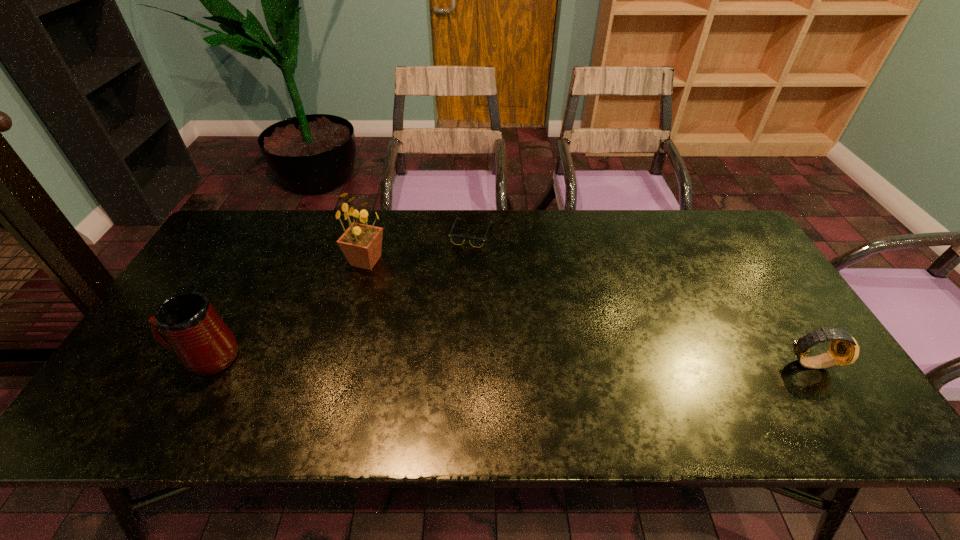
Where is `vacant space located 0.320m on the lenses of the shortest object`? The width and height of the screenshot is (960, 540). vacant space located 0.320m on the lenses of the shortest object is located at coordinates (508, 324).

Locate an element on the screen. This screenshot has width=960, height=540. free space located at the front of the second object from left to right with flowers visible is located at coordinates (411, 345).

I want to click on free location located 0.220m at the front of the second object from left to right with flowers visible, so click(x=399, y=323).

You are a GUI agent. You are given a task and a screenshot of the screen. Output one action in this format:
    pyautogui.click(x=<x>, y=<y>)
    Task: Click on the vacant region located 0.090m at the front of the second object from left to right with flowers visible
    This screenshot has width=960, height=540.
    Given the screenshot: What is the action you would take?
    pyautogui.click(x=384, y=292)

The height and width of the screenshot is (540, 960). I want to click on sunglasses located at the far edge, so click(456, 239).

Locate an element on the screen. Image resolution: width=960 pixels, height=540 pixels. sunflower that is at the far edge is located at coordinates (361, 243).

In order to click on mug that is at the near edge in this screenshot , I will do `click(186, 323)`.

Identify the location of watch that is at the near edge. Image resolution: width=960 pixels, height=540 pixels. click(844, 350).

This screenshot has height=540, width=960. Identify the location of object present at the left edge. (186, 323).

Locate an element on the screen. The width and height of the screenshot is (960, 540). object positioned at the right edge is located at coordinates (844, 350).